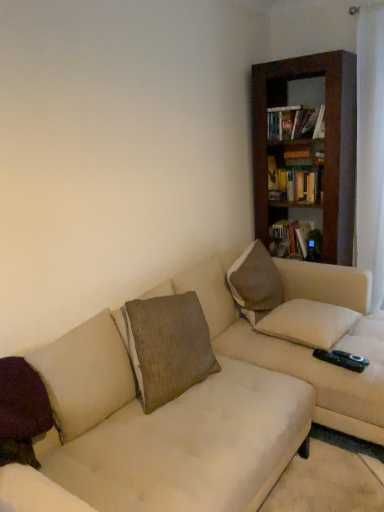
Question: Can you confirm if hardcover book at upper right, acting as the 1th book starting from the top, is taller than hardcover book at upper right, marked as the 1th book in a back-to-front arrangement?

Choices:
 (A) yes
 (B) no

Answer: (B)

Question: Is hardcover book at upper right, the 2th book ordered from the bottom, beside hardcover book at upper right, which ranks as the 1th book in bottom-to-top order?

Choices:
 (A) yes
 (B) no

Answer: (B)

Question: Considering the relative sizes of hardcover book at upper right, acting as the 1th book starting from the top, and hardcover book at upper right, which appears as the second book when viewed from the front, in the image provided, is hardcover book at upper right, acting as the 1th book starting from the top, bigger than hardcover book at upper right, which appears as the second book when viewed from the front,?

Choices:
 (A) no
 (B) yes

Answer: (A)

Question: Is hardcover book at upper right, the 2th book ordered from the bottom, at the left side of hardcover book at upper right, marked as the 1th book in a back-to-front arrangement?

Choices:
 (A) no
 (B) yes

Answer: (B)

Question: From a real-world perspective, is hardcover book at upper right, the 2th book ordered from the bottom, positioned over hardcover book at upper right, which ranks as the 1th book in bottom-to-top order, based on gravity?

Choices:
 (A) yes
 (B) no

Answer: (A)

Question: Can you confirm if hardcover book at upper right, the 1th book in the front-to-back sequence, is thinner than hardcover book at upper right, which appears as the second book when viewed from the front?

Choices:
 (A) yes
 (B) no

Answer: (A)

Question: Is hardcover book at upper right, the 1th book in the front-to-back sequence, closer to the viewer compared to white textured pillow at center, placed as the first pillow when sorted from right to left?

Choices:
 (A) yes
 (B) no

Answer: (B)

Question: Is hardcover book at upper right, which appears as the second book when viewed from the back, aimed at white textured pillow at center, the second pillow positioned from the back?

Choices:
 (A) no
 (B) yes

Answer: (A)

Question: Does hardcover book at upper right, the 1th book in the front-to-back sequence, come behind white textured pillow at center, the 2th pillow from the front?

Choices:
 (A) no
 (B) yes

Answer: (B)

Question: Considering the relative positions of hardcover book at upper right, which appears as the second book when viewed from the back, and white textured pillow at center, arranged as the third pillow when viewed from the left, in the image provided, is hardcover book at upper right, which appears as the second book when viewed from the back, to the right of white textured pillow at center, arranged as the third pillow when viewed from the left, from the viewer's perspective?

Choices:
 (A) no
 (B) yes

Answer: (B)

Question: From a real-world perspective, is hardcover book at upper right, acting as the 1th book starting from the top, positioned under white textured pillow at center, arranged as the third pillow when viewed from the left, based on gravity?

Choices:
 (A) yes
 (B) no

Answer: (B)

Question: Considering the relative sizes of hardcover book at upper right, the 2th book ordered from the bottom, and white textured pillow at center, the 2th pillow from the front, in the image provided, is hardcover book at upper right, the 2th book ordered from the bottom, bigger than white textured pillow at center, the 2th pillow from the front,?

Choices:
 (A) no
 (B) yes

Answer: (A)

Question: Is brown wooden bookcase at upper right positioned beyond the bounds of hardcover book at upper right, the second book in the top-to-bottom sequence?

Choices:
 (A) yes
 (B) no

Answer: (A)